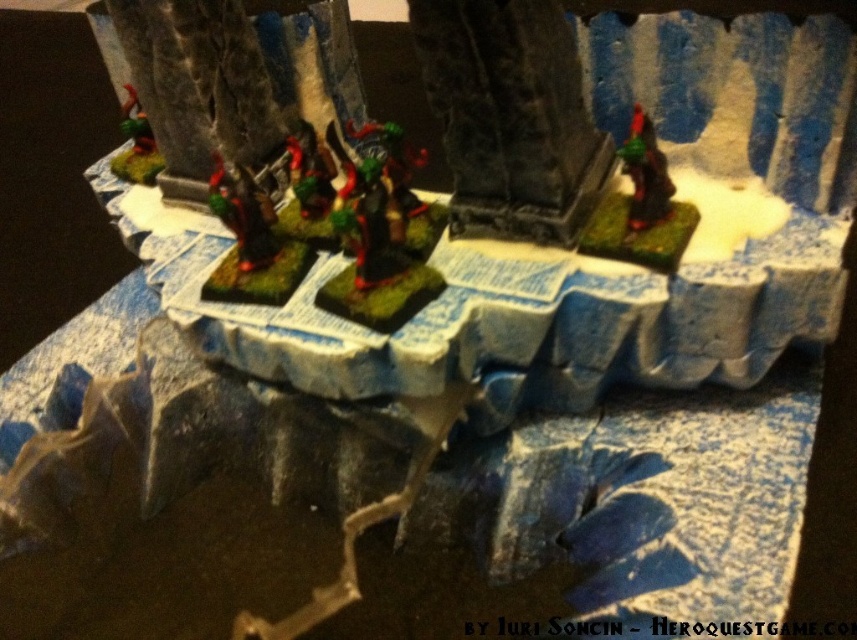
Question: Does shiny red plastic figure at right appear on the right side of green matte miniature at upper left?

Choices:
 (A) no
 (B) yes

Answer: (B)

Question: Which of these objects is positioned closest to the green matte miniature at upper right?

Choices:
 (A) matte black figure at center
 (B) green matte miniature at upper left
 (C) shiny red plastic figure at right

Answer: (C)

Question: Is shiny red plastic figure at right above green matte miniature at upper left?

Choices:
 (A) yes
 (B) no

Answer: (B)

Question: Which object is farther from the camera taking this photo?

Choices:
 (A) green matte miniature at upper right
 (B) green matte miniature at upper left
 (C) shiny red plastic figure at right

Answer: (B)

Question: Which object is positioned closest to the green matte miniature at upper right?

Choices:
 (A) matte black figure at center
 (B) green matte miniature at upper left

Answer: (A)

Question: Does matte black figure at center appear over green matte miniature at upper left?

Choices:
 (A) no
 (B) yes

Answer: (A)